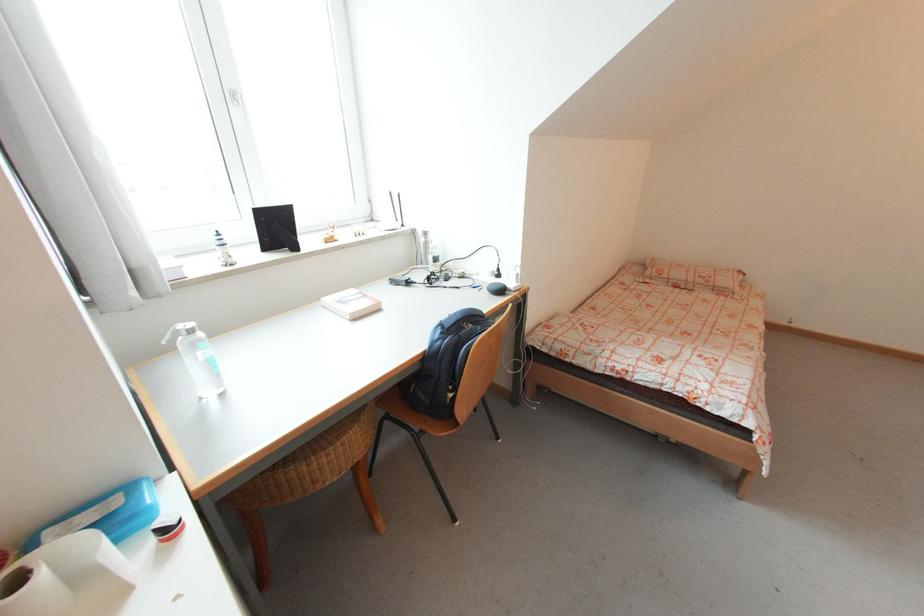
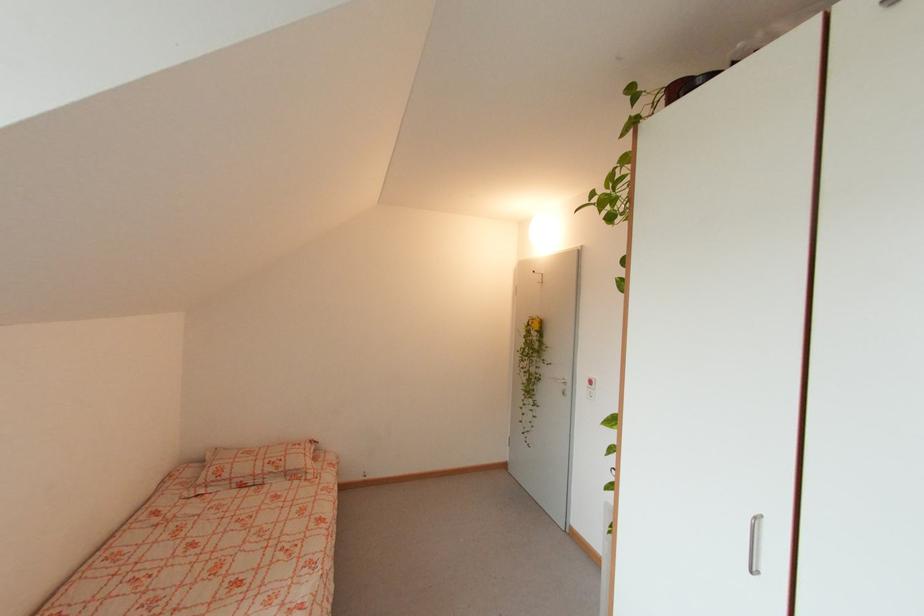
Question: The images are taken continuously from a first-person perspective. In which direction is your viewpoint rotating?

Choices:
 (A) Left
 (B) Right
 (C) Up
 (D) Down

Answer: (B)